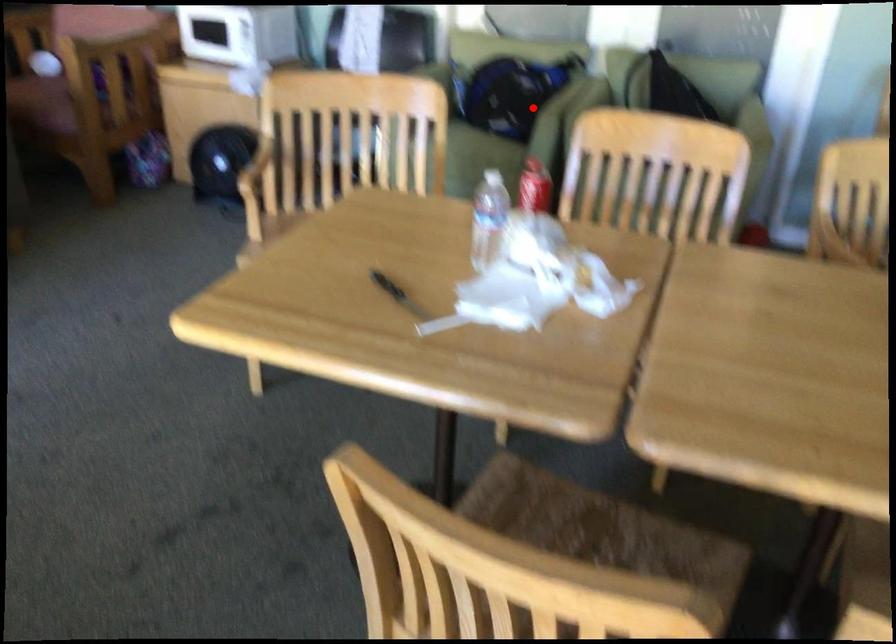
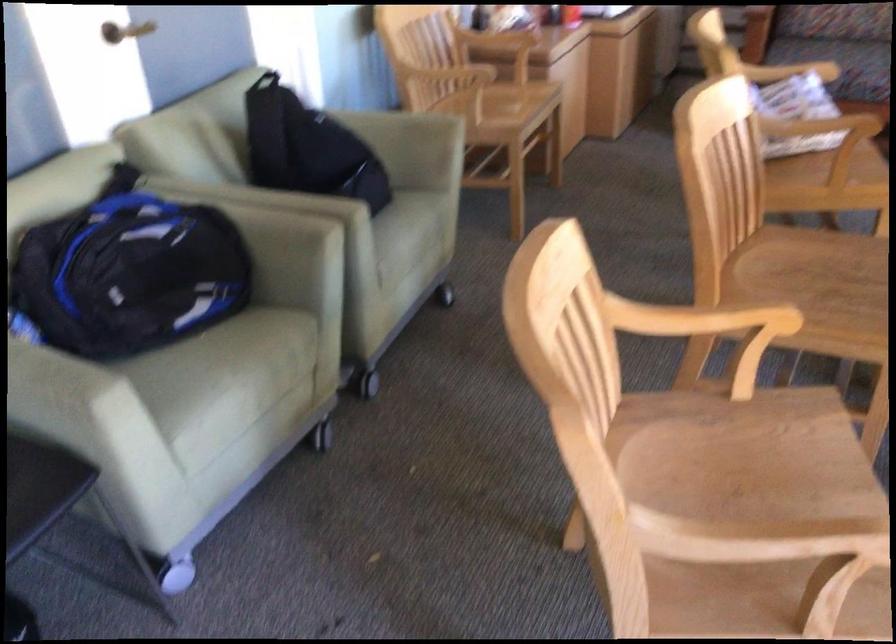
Question: A red point is marked in image1. In image2, is the corresponding 3D point closer to the camera or farther? Reply with the corresponding letter.

Choices:
 (A) The corresponding 3D point is closer.
 (B) The corresponding 3D point is farther.

Answer: (A)